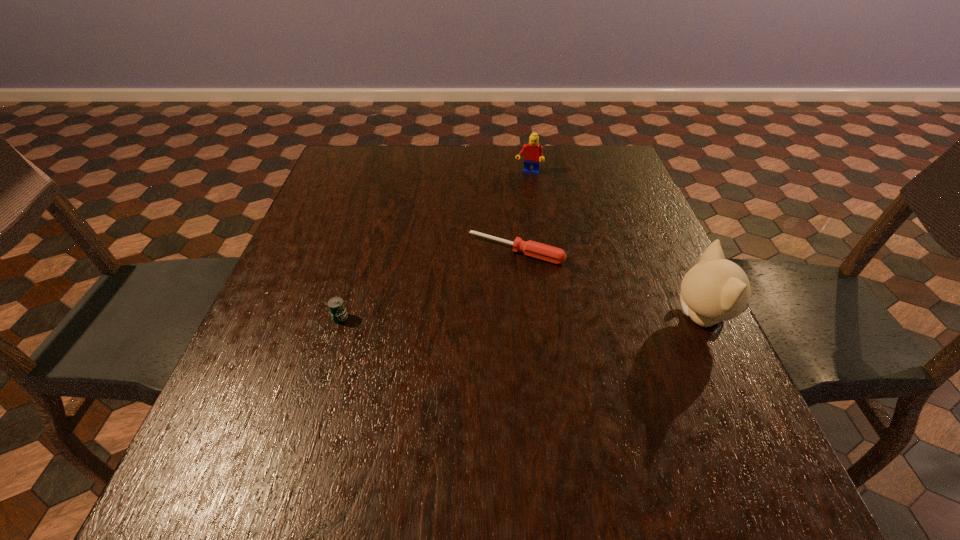
Locate an element on the screen. vacant space on the desktop that is between the leftmost object and the kitten and is positioned on the front-facing side of the third shortest object is located at coordinates click(486, 318).

At what (x,y) coordinates should I click in order to perform the action: click on free space on the desktop that is between the leftmost object and the tallest object and is positioned at the blade of the screwdriver. Please return your answer as a coordinate pair (x, y). The image size is (960, 540). Looking at the image, I should click on point(475,318).